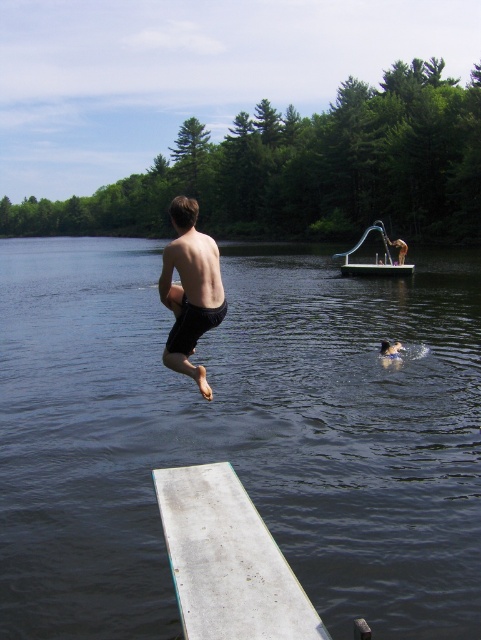
You are a photographer trying to capture the scene of the person jumping into the lake. You need to ensure both the white matte dock at lower center and the matte black shorts at center are visible in your shot. Based on their spatial relationship, which object should you prioritize framing closer to the edge of the photo?

The white matte dock at lower center occupies less space than the matte black shorts at center, so you should prioritize framing the white matte dock at lower center closer to the edge of the photo to ensure both are visible.